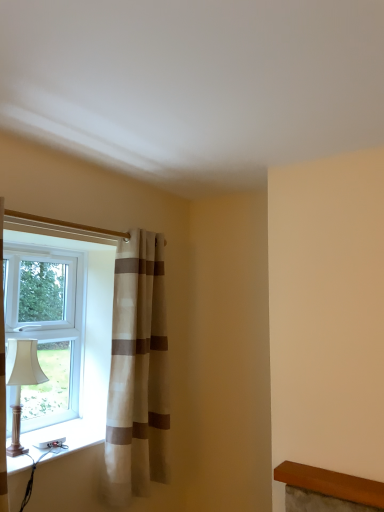
Question: From the image's perspective, would you say beige striped curtain at left is positioned over matte white lampshade at left?

Choices:
 (A) no
 (B) yes

Answer: (B)

Question: Is the position of beige striped curtain at left more distant than that of matte white lampshade at left?

Choices:
 (A) no
 (B) yes

Answer: (B)

Question: Is beige striped curtain at left wider than matte white lampshade at left?

Choices:
 (A) no
 (B) yes

Answer: (A)

Question: Is beige striped curtain at left turned away from matte white lampshade at left?

Choices:
 (A) yes
 (B) no

Answer: (B)

Question: Can you confirm if beige striped curtain at left is taller than matte white lampshade at left?

Choices:
 (A) no
 (B) yes

Answer: (B)

Question: Can you confirm if beige striped curtain at left is positioned to the left of matte white lampshade at left?

Choices:
 (A) yes
 (B) no

Answer: (B)

Question: Can white plastic window sill at lower left be found inside white plastic window at left?

Choices:
 (A) yes
 (B) no

Answer: (B)

Question: Is white plastic window at left further to camera compared to white plastic window sill at lower left?

Choices:
 (A) no
 (B) yes

Answer: (B)

Question: Considering the relative sizes of white plastic window at left and white plastic window sill at lower left in the image provided, is white plastic window at left shorter than white plastic window sill at lower left?

Choices:
 (A) no
 (B) yes

Answer: (A)

Question: From a real-world perspective, is white plastic window at left positioned under white plastic window sill at lower left based on gravity?

Choices:
 (A) no
 (B) yes

Answer: (A)

Question: Is white plastic window at left oriented towards white plastic window sill at lower left?

Choices:
 (A) yes
 (B) no

Answer: (A)

Question: Is white plastic window at left placed right next to white plastic window sill at lower left?

Choices:
 (A) yes
 (B) no

Answer: (B)

Question: Is white plastic window sill at lower left to the right of beige striped curtain at left from the viewer's perspective?

Choices:
 (A) no
 (B) yes

Answer: (A)